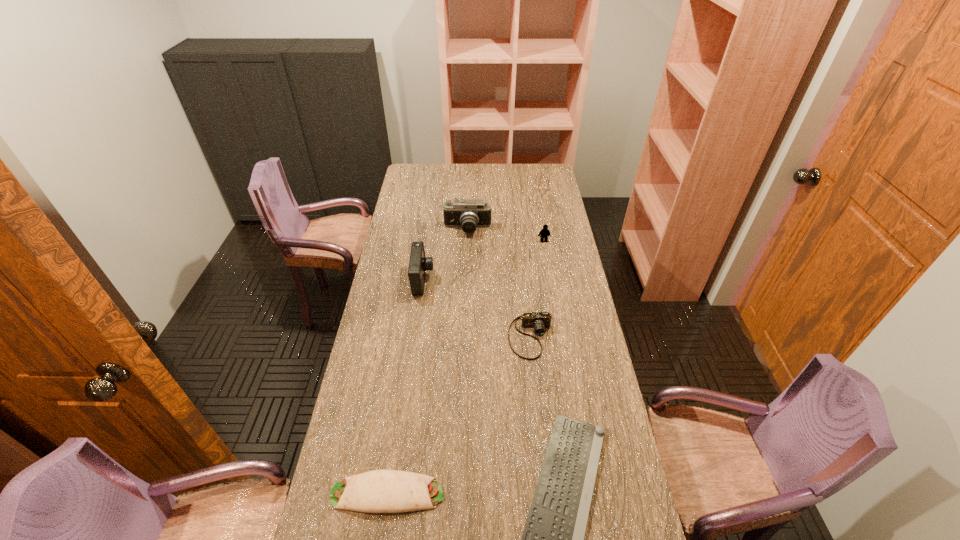
Choose which object is the nearest neighbor to the Lego. Please provide its 2D coordinates. Your answer should be formatted as a tuple, i.e. [(x, y)], where the tuple contains the x and y coordinates of a point satisfying the conditions above.

[(469, 214)]

Where is `object that is the fourth closest to the third shortest object`? object that is the fourth closest to the third shortest object is located at coordinates (545, 233).

Choose which camera is the nearest neighbor to the third tallest object. Please provide its 2D coordinates. Your answer should be formatted as a tuple, i.e. [(x, y)], where the tuple contains the x and y coordinates of a point satisfying the conditions above.

[(469, 214)]

Locate which camera is the closest to the leftmost camera. Please provide its 2D coordinates. Your answer should be formatted as a tuple, i.e. [(x, y)], where the tuple contains the x and y coordinates of a point satisfying the conditions above.

[(469, 214)]

You are a GUI agent. You are given a task and a screenshot of the screen. Output one action in this format:
    pyautogui.click(x=<x>, y=<y>)
    Task: Click on the vacant region that satisfies the following two spatial constraints: 1. on the front-facing side of the farthest camera; 2. on the front-facing side of the leftmost camera
    The height and width of the screenshot is (540, 960).
    Given the screenshot: What is the action you would take?
    pyautogui.click(x=466, y=280)

The height and width of the screenshot is (540, 960). Identify the location of vacant area in the image that satisfies the following two spatial constraints: 1. on the face of the second farthest object; 2. at the bitten end of the second shortest object. (587, 493).

This screenshot has width=960, height=540. Identify the location of vacant region that satisfies the following two spatial constraints: 1. on the front-facing side of the farthest object; 2. at the bitten end of the second shortest object. (459, 493).

Identify the location of free point that satisfies the following two spatial constraints: 1. on the face of the Lego; 2. on the front-facing side of the second farthest camera. This screenshot has width=960, height=540. (550, 280).

Identify the location of vacant space that satisfies the following two spatial constraints: 1. on the face of the Lego; 2. at the bitten end of the fifth tallest object. The width and height of the screenshot is (960, 540). (587, 493).